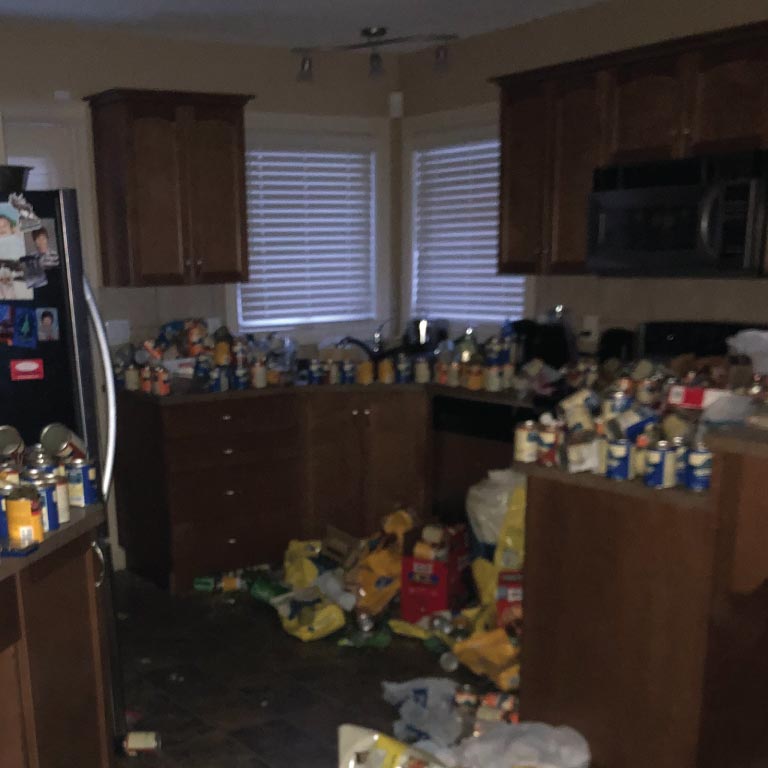
Where is `sink`? This screenshot has width=768, height=768. sink is located at coordinates (382, 352).